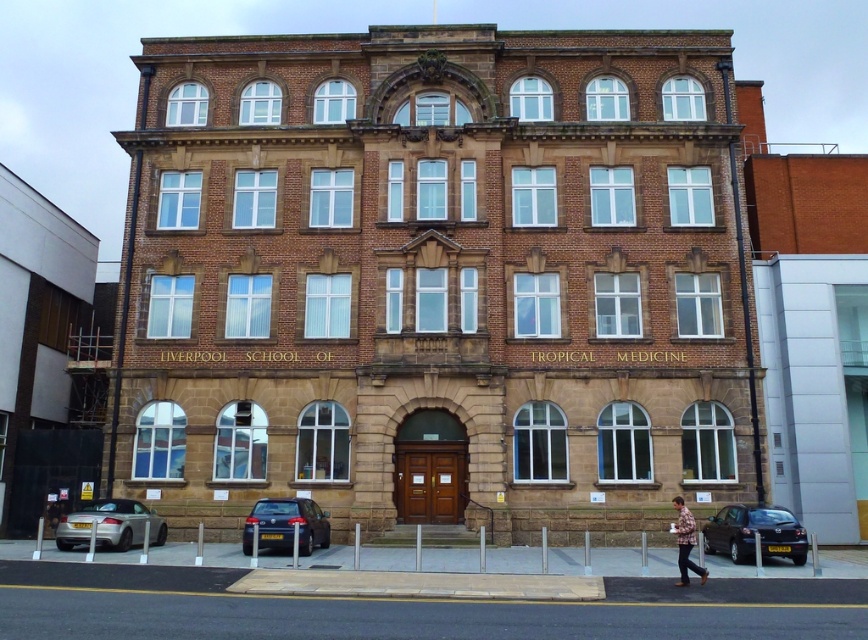
Is point (97, 531) behind point (682, 563)?

Yes.

Is silver metallic car at lower left wider than flannel shirt at lower right?

Indeed, silver metallic car at lower left has a greater width compared to flannel shirt at lower right.

Who is more distant from viewer, [97,538] or [684,586]?

The point [97,538] is behind.

The height and width of the screenshot is (640, 868). In order to click on silver metallic car at lower left in this screenshot , I will do [x=110, y=524].

Is point (783, 529) farther from viewer compared to point (129, 531)?

That is False.

Does matte black car at lower right have a smaller size compared to silver metallic car at lower left?

Indeed, matte black car at lower right has a smaller size compared to silver metallic car at lower left.

Who is more distant from viewer, (x=786, y=529) or (x=141, y=529)?

The point (x=141, y=529) is more distant.

The image size is (868, 640). I want to click on matte black car at lower right, so click(754, 532).

Is matte black car at lower right wider than flannel shirt at lower right?

Yes.

Does matte black car at lower right have a smaller size compared to flannel shirt at lower right?

Correct, matte black car at lower right occupies less space than flannel shirt at lower right.

Is point (777, 509) closer to viewer compared to point (694, 540)?

No.

Find the location of `matte black car at lower right`. matte black car at lower right is located at coordinates (754, 532).